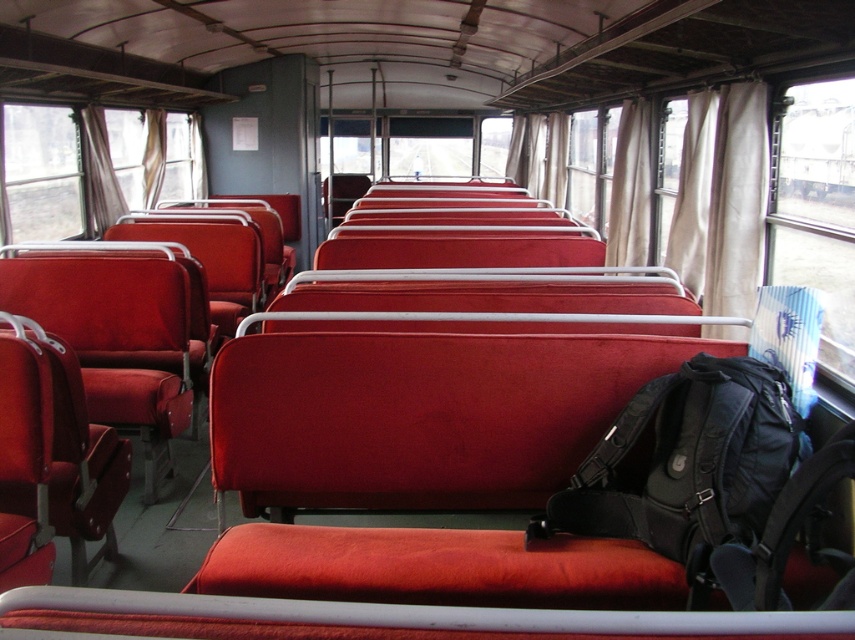
You are standing inside the bus and looking at two points marked on the window. The first point is at coordinates point (37,154) and the second is at point (62,145). Which point is nearer to you?

Point (37,154) is closer to the viewer than point (62,145).

You are a passenger on the bus and want to look outside through the window. Which object at point (42, 172) can you use to see the outside view?

The transparent fabric window at upper left located at point (42, 172) allows you to see the outside view.

You are a passenger on the bus and want to know if you can fit a 2.5 centimeter wide book between the transparent fabric window at upper left and the transparent glass window at left. Can you fit it there?

The distance between the transparent fabric window at upper left and the transparent glass window at left is 2.29 centimeters. Since the book is 2.5 centimeters wide, it is slightly wider than the available space. Therefore, the book cannot fit between them.